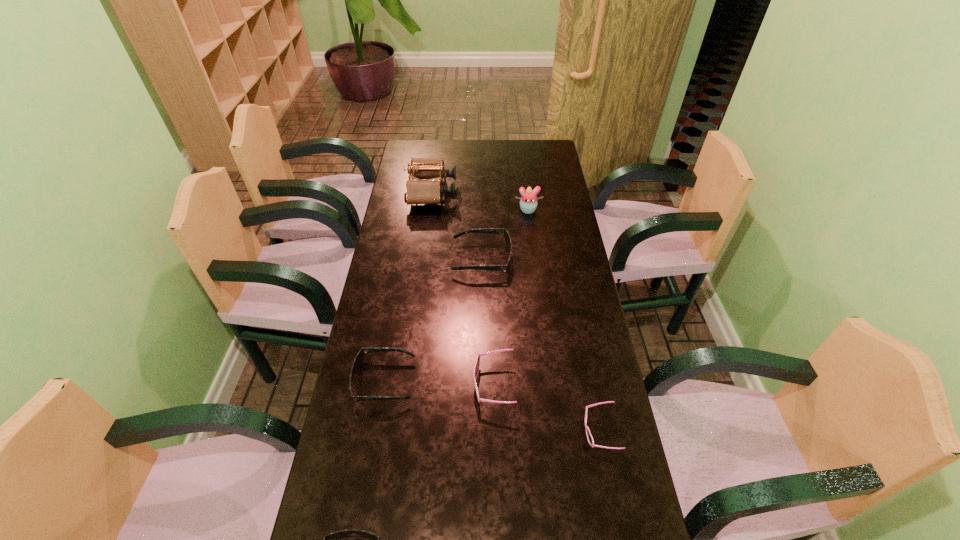
Find the location of a particular element. The image size is (960, 540). binoculars is located at coordinates (418, 191).

The image size is (960, 540). I want to click on cupcake, so click(x=528, y=203).

Find the location of a particular element. Image resolution: width=960 pixels, height=540 pixels. the second object from right to left is located at coordinates tap(528, 203).

I want to click on the farthest black sunglasses, so click(506, 235).

What are the coordinates of `the fifth nearest object` in the screenshot? It's located at (506, 235).

Identify the location of the left pink sunglasses. The height and width of the screenshot is (540, 960). (476, 368).

The height and width of the screenshot is (540, 960). Identify the location of the second smallest black sunglasses. (358, 360).

Identify the location of the right pink sunglasses. The width and height of the screenshot is (960, 540). (589, 437).

Where is `the rightmost sunglasses`? The image size is (960, 540). the rightmost sunglasses is located at coordinates (589, 437).

Where is `free region located 0.180m through the eyepieces of the tallest object`? Image resolution: width=960 pixels, height=540 pixels. free region located 0.180m through the eyepieces of the tallest object is located at coordinates (498, 192).